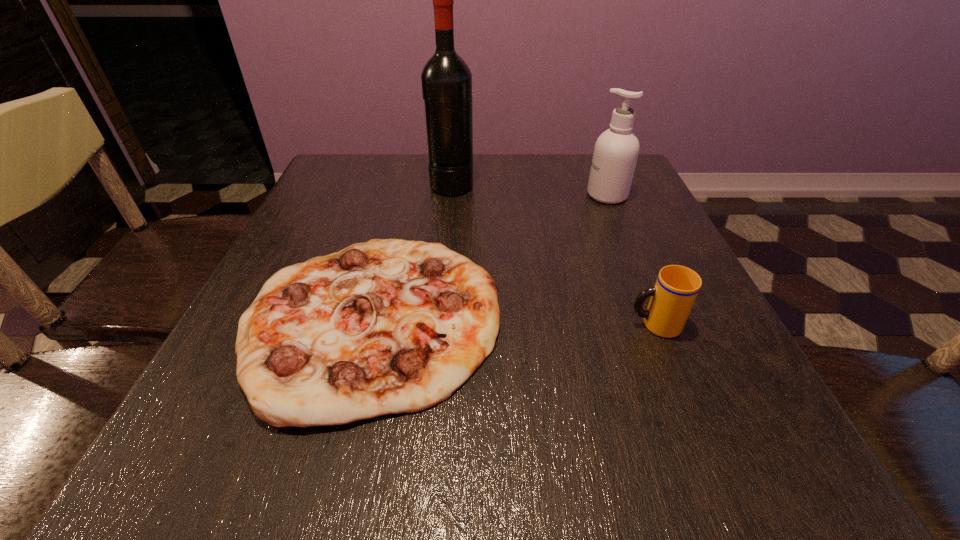
In order to click on the tallest object in this screenshot , I will do `click(446, 79)`.

Identify the location of cleansing agent. This screenshot has width=960, height=540. (616, 151).

You are a GUI agent. You are given a task and a screenshot of the screen. Output one action in this format:
    pyautogui.click(x=<x>, y=<y>)
    Task: Click on the cup
    
    Given the screenshot: What is the action you would take?
    pyautogui.click(x=672, y=298)

Where is `the shortest object`? The width and height of the screenshot is (960, 540). the shortest object is located at coordinates (389, 326).

The width and height of the screenshot is (960, 540). What are the coordinates of `free space located on the right of the wine bottle` in the screenshot? It's located at (563, 184).

Where is `vacant region located on the front label of the third shortest object`? The image size is (960, 540). vacant region located on the front label of the third shortest object is located at coordinates (562, 195).

Where is `vacant space located 0.050m on the front label of the third shortest object`? vacant space located 0.050m on the front label of the third shortest object is located at coordinates (565, 195).

At what (x,y) coordinates should I click in order to perform the action: click on vacant space located 0.080m on the front label of the third shortest object. Please return your answer as a coordinate pair (x, y). This screenshot has width=960, height=540. Looking at the image, I should click on (553, 195).

I want to click on vacant space situated 0.270m on the side of the cup with the handle, so click(x=466, y=325).

Find the location of a particular element. vacant space located 0.220m on the side of the cup with the handle is located at coordinates (496, 325).